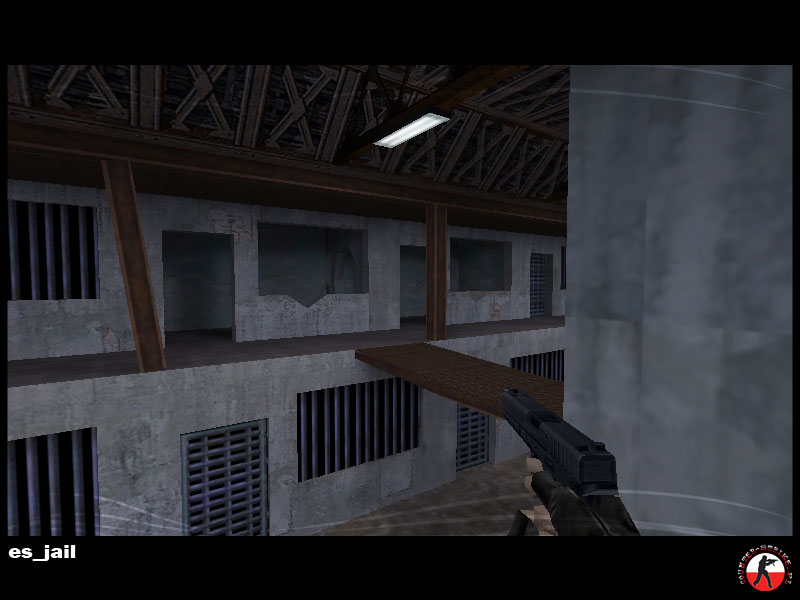
I want to click on floor, so click(x=465, y=496).